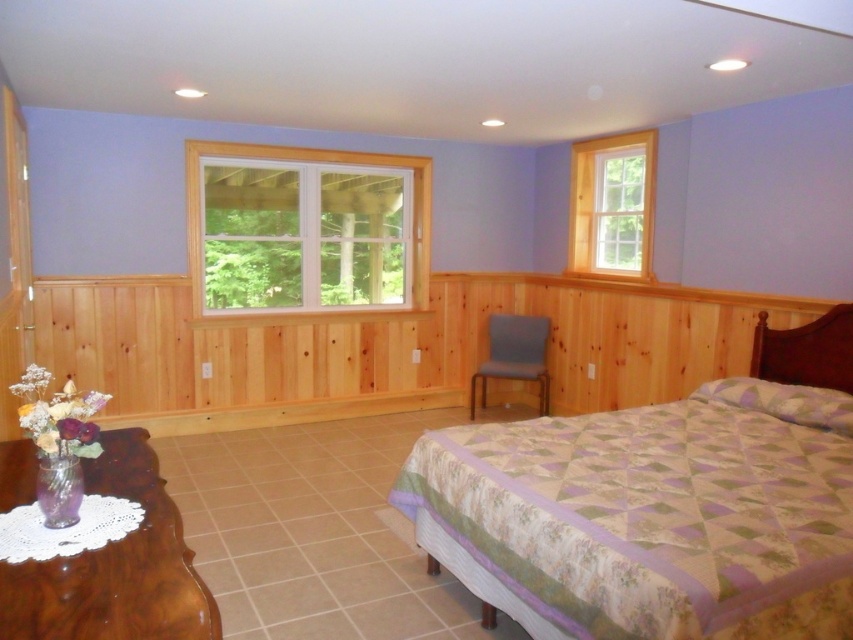
Question: Does white plastic window at upper left appear under mahogany wood dresser at lower left?

Choices:
 (A) yes
 (B) no

Answer: (B)

Question: Which point is closer to the camera?

Choices:
 (A) patterned fabric bed at center
 (B) white plastic window at upper left
 (C) mahogany wood dresser at lower left

Answer: (C)

Question: Which of these objects is positioned farthest from the clear glass window at upper right?

Choices:
 (A) matte blue chair at center
 (B) patterned fabric bed at center

Answer: (B)

Question: Is the position of mahogany wood dresser at lower left less distant than that of clear glass window at upper right?

Choices:
 (A) no
 (B) yes

Answer: (B)

Question: Which point is closer to the camera?

Choices:
 (A) (67, 404)
 (B) (339, 262)
 (C) (48, 632)

Answer: (C)

Question: Can you confirm if patterned fabric bed at center is positioned below translucent glass vase at lower left?

Choices:
 (A) no
 (B) yes

Answer: (B)